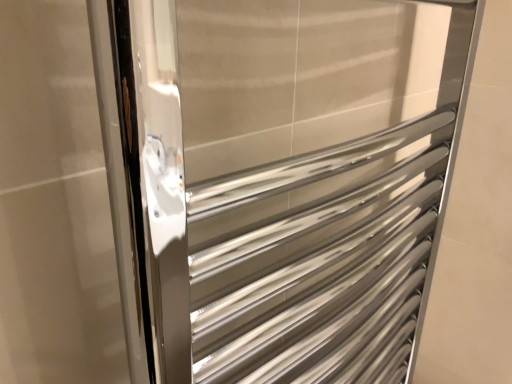
Describe the element at coordinates (285, 184) in the screenshot. I see `polished stainless steel towel rack at center` at that location.

Locate an element on the screen. This screenshot has width=512, height=384. polished stainless steel towel rack at center is located at coordinates (285, 184).

You are a GUI agent. You are given a task and a screenshot of the screen. Output one action in this format:
    pyautogui.click(x=<x>, y=<y>)
    Task: Click on the polished stainless steel towel rack at center
    This screenshot has width=512, height=384.
    Given the screenshot: What is the action you would take?
    pyautogui.click(x=285, y=184)